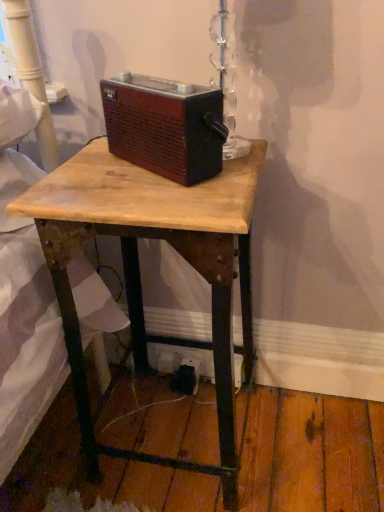
Where is `brown wood radio at center`? The image size is (384, 512). brown wood radio at center is located at coordinates (165, 126).

Describe the element at coordinates (165, 126) in the screenshot. I see `brown wood radio at center` at that location.

What is the approximate height of black plastic outlet at lower center?

black plastic outlet at lower center is 3.24 inches in height.

Locate an element on the screen. This screenshot has height=512, width=384. black plastic outlet at lower center is located at coordinates (188, 377).

This screenshot has width=384, height=512. What are the coordinates of `wooden desk at center` in the screenshot? It's located at (139, 270).

Is black plastic outlet at lower center outside of brown wood radio at center?

black plastic outlet at lower center lies outside brown wood radio at center's area.

Which object is wider, black plastic outlet at lower center or brown wood radio at center?

Wider between the two is brown wood radio at center.

Is black plastic outlet at lower center positioned behind brown wood radio at center?

Yes, black plastic outlet at lower center is behind brown wood radio at center.

Consider the image. Could you tell me if black plastic outlet at lower center is facing brown wood radio at center?

No, black plastic outlet at lower center does not turn towards brown wood radio at center.

Considering the points (185, 368) and (79, 384), which point is in front, point (185, 368) or point (79, 384)?

Point (79, 384)

Does black plastic outlet at lower center have a lesser width compared to wooden desk at center?

Yes, black plastic outlet at lower center is thinner than wooden desk at center.

Looking at this image, is black plastic outlet at lower center oriented towards wooden desk at center?

Yes, black plastic outlet at lower center faces towards wooden desk at center.

The image size is (384, 512). What are the coordinates of `desk that is on the left side of black plastic outlet at lower center` in the screenshot? It's located at (139, 270).

This screenshot has height=512, width=384. I want to click on gadget located above the wooden desk at center (from a real-world perspective), so click(165, 126).

Which object is positioned more to the right, wooden desk at center or brown wood radio at center?

wooden desk at center.

From a real-world perspective, which is physically above, wooden desk at center or brown wood radio at center?

brown wood radio at center, from a real-world perspective.

Is wooden desk at center shorter than brown wood radio at center?

No.

From the picture: Does brown wood radio at center contain black plastic outlet at lower center?

Definitely not — black plastic outlet at lower center is not inside brown wood radio at center.

Does point (155, 97) lie behind point (184, 358)?

That is False.

In the scene shown: Who is more distant, brown wood radio at center or black plastic outlet at lower center?

black plastic outlet at lower center is further away from the camera.

From the image's perspective, would you say brown wood radio at center is shown under black plastic outlet at lower center?

Actually, brown wood radio at center appears above black plastic outlet at lower center in the image.

The image size is (384, 512). Identify the location of desk above the black plastic outlet at lower center (from a real-world perspective). (139, 270).

Which is less distant, (223, 396) or (183, 380)?

The point (223, 396) is closer.

Can you tell me how much wooden desk at center and black plastic outlet at lower center differ in facing direction?

The angular difference between wooden desk at center and black plastic outlet at lower center is 1.05 degrees.

Considering the sizes of objects wooden desk at center and black plastic outlet at lower center in the image provided, who is thinner, wooden desk at center or black plastic outlet at lower center?

black plastic outlet at lower center.

Is brown wood radio at center touching wooden desk at center?

No, brown wood radio at center is not beside wooden desk at center.

Which is closer to the camera, (x=137, y=110) or (x=213, y=311)?

The point (x=137, y=110) is in front.

Is brown wood radio at center positioned beyond the bounds of wooden desk at center?

Indeed, brown wood radio at center is completely outside wooden desk at center.

This screenshot has width=384, height=512. What are the coordinates of `electric outlet below the brown wood radio at center (from a real-world perspective)` in the screenshot? It's located at (188, 377).

I want to click on desk on the left of black plastic outlet at lower center, so click(x=139, y=270).

Which object lies nearer to the anchor point wooden desk at center, black plastic outlet at lower center or brown wood radio at center?

Among the two, brown wood radio at center is located nearer to wooden desk at center.

Consider the image. Which object lies further to the anchor point brown wood radio at center, black plastic outlet at lower center or wooden desk at center?

black plastic outlet at lower center is positioned further to the anchor brown wood radio at center.

Based on their spatial positions, is brown wood radio at center or black plastic outlet at lower center closer to wooden desk at center?

The object closer to wooden desk at center is brown wood radio at center.

Which object lies further to the anchor point brown wood radio at center, wooden desk at center or black plastic outlet at lower center?

The object further to brown wood radio at center is black plastic outlet at lower center.

Considering their positions, is wooden desk at center positioned closer to black plastic outlet at lower center than brown wood radio at center?

Among the two, wooden desk at center is located nearer to black plastic outlet at lower center.

Looking at the image, which one is located further to black plastic outlet at lower center, brown wood radio at center or wooden desk at center?

brown wood radio at center is positioned further to the anchor black plastic outlet at lower center.

The image size is (384, 512). Find the location of `gadget located between wooden desk at center and black plastic outlet at lower center in the depth direction`. gadget located between wooden desk at center and black plastic outlet at lower center in the depth direction is located at coordinates (165, 126).